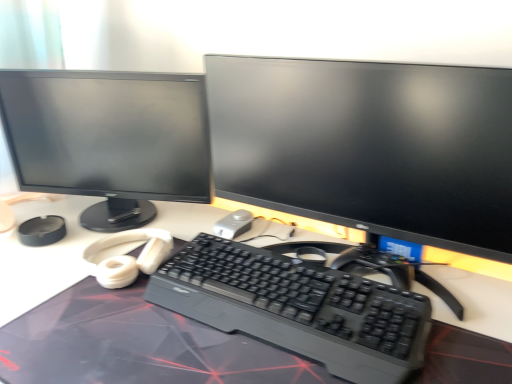
The height and width of the screenshot is (384, 512). What are the coordinates of `vacant area to the left of satin silver mouse at center` in the screenshot? It's located at (173, 221).